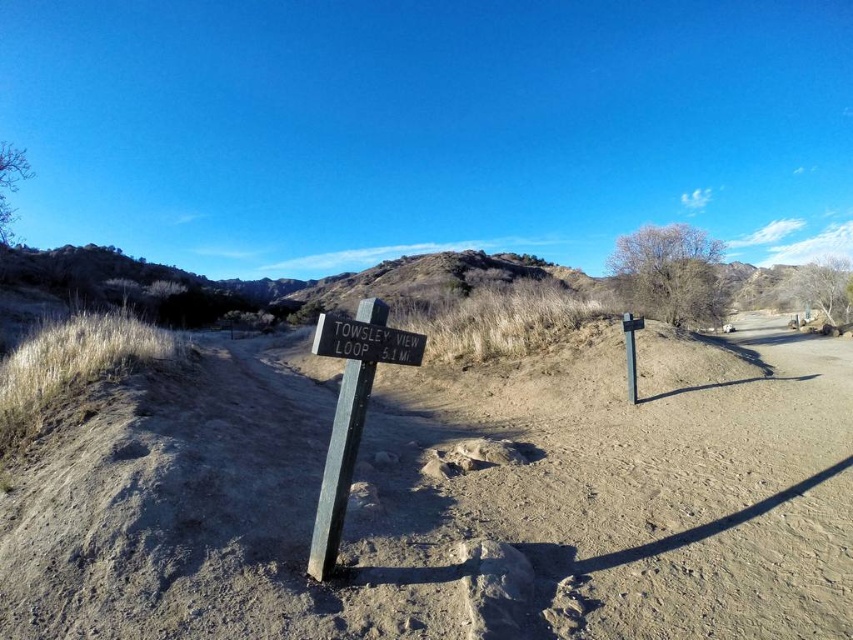
Question: Is brown sandy dirt track at center positioned behind wooden signpost at center?

Choices:
 (A) yes
 (B) no

Answer: (B)

Question: Which point is farther from the camera taking this photo?

Choices:
 (A) (39, 492)
 (B) (393, 362)
 (C) (376, 316)

Answer: (B)

Question: Which point is farther to the camera?

Choices:
 (A) (369, 332)
 (B) (334, 428)
 (C) (436, 572)

Answer: (B)

Question: Does brown sandy dirt track at center appear under wooden signpost at center?

Choices:
 (A) yes
 (B) no

Answer: (A)

Question: Which object is positioned farthest from the wooden signpost at center?

Choices:
 (A) wooden sign at center
 (B) brown sandy dirt track at center

Answer: (B)

Question: Does brown sandy dirt track at center appear over wooden sign at center?

Choices:
 (A) yes
 (B) no

Answer: (B)